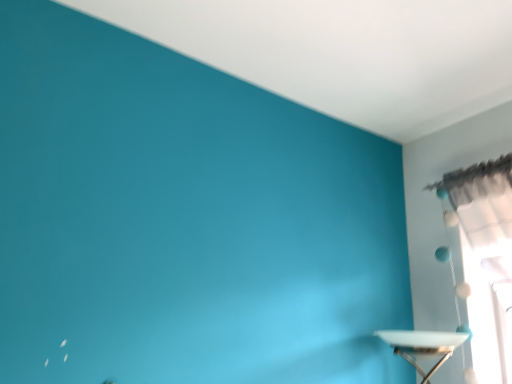
This screenshot has width=512, height=384. What do you see at coordinates (487, 225) in the screenshot?
I see `textured gray curtain at upper right` at bounding box center [487, 225].

I want to click on textured gray curtain at upper right, so pyautogui.click(x=487, y=225).

Find the location of a particular element. textured gray curtain at upper right is located at coordinates (487, 225).